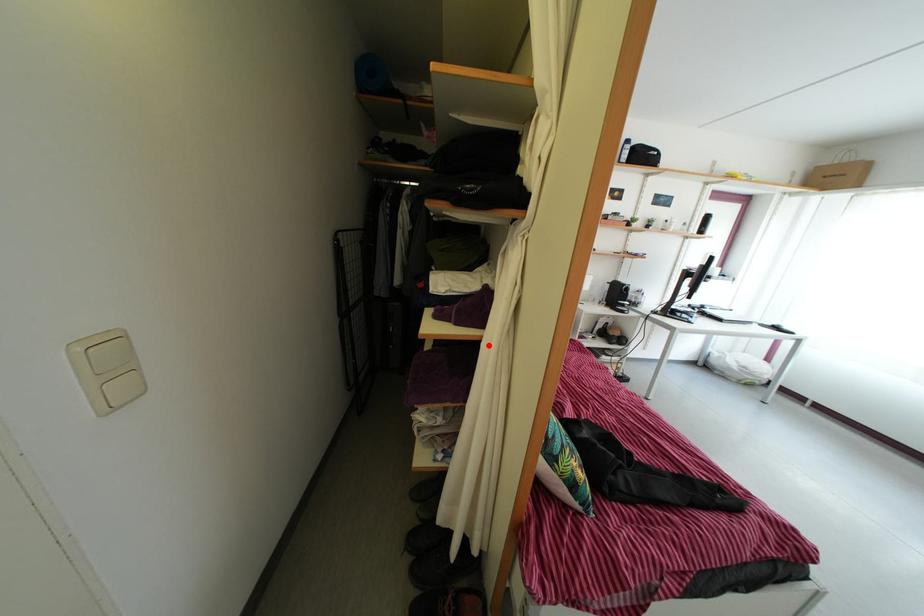
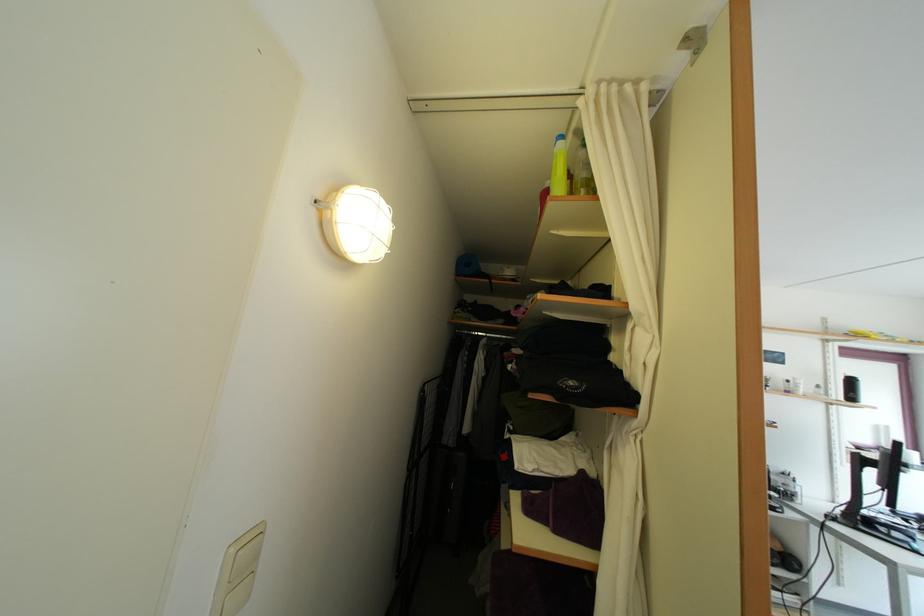
Find the pixel in the second image that matches the highlighted location in the first image.

(602, 576)